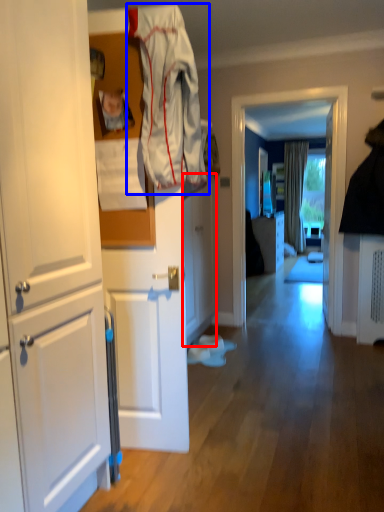
Question: Which of the following is the farthest to the observer, cabinetry (highlighted by a red box) or clothing (highlighted by a blue box)?

Choices:
 (A) cabinetry
 (B) clothing

Answer: (A)